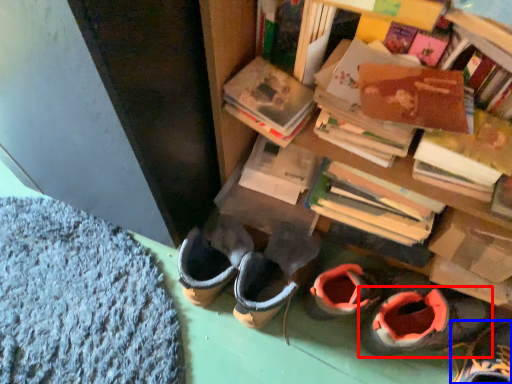
Question: Among these objects, which one is farthest to the camera, footwear (highlighted by a red box) or footwear (highlighted by a blue box)?

Choices:
 (A) footwear
 (B) footwear

Answer: (A)